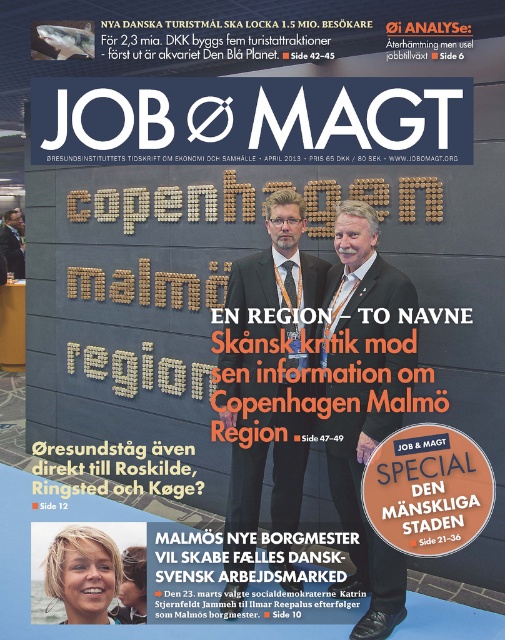
In the scene shown: You are a photographer who needs to adjust the lighting to ensure both the blonde hair at upper center and the matte black suit at center are visible. Considering their relative heights, which object should you focus on first to balance the exposure?

The blonde hair at upper center has a lesser height compared to the matte black suit at center. Therefore, you should focus on the matte black suit at center first because it is taller and might require more light adjustment to ensure proper exposure for both subjects.

What is the location of the white textured suit at center on the magazine cover?

The white textured suit at center is located at point coordinates [365,401].